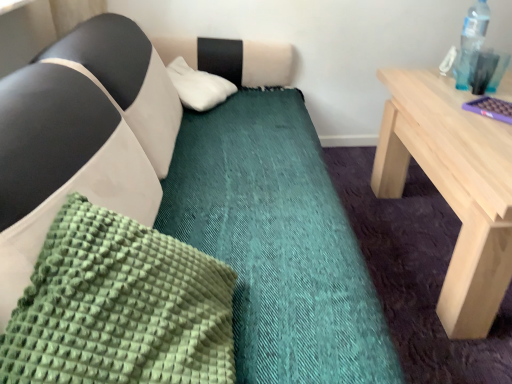
Question: From the image's perspective, is green textured pillow at lower left, the 1th pillow from the bottom, above or below transparent plastic bottle at upper right?

Choices:
 (A) below
 (B) above

Answer: (A)

Question: Which is correct: green textured pillow at lower left, the 1th pillow from the bottom, is inside transparent plastic bottle at upper right, or outside of it?

Choices:
 (A) inside
 (B) outside

Answer: (B)

Question: Which is farther from the green textured pillow at lower left, the 1th pillow from the bottom?

Choices:
 (A) transparent plastic bottle at upper right
 (B) white fluffy pillow at upper center, placed as the second pillow when sorted from bottom to top

Answer: (A)

Question: Which of these objects is positioned farthest from the white fluffy pillow at upper center, which is the 1th pillow from top to bottom?

Choices:
 (A) green textured pillow at lower left, which appears as the 2th pillow when viewed from the back
 (B) transparent plastic bottle at upper right

Answer: (A)